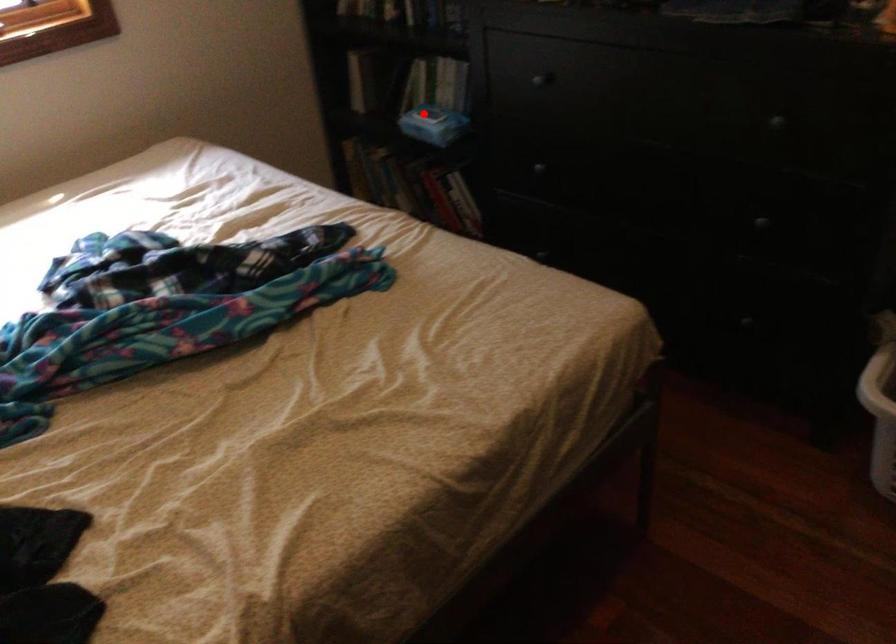
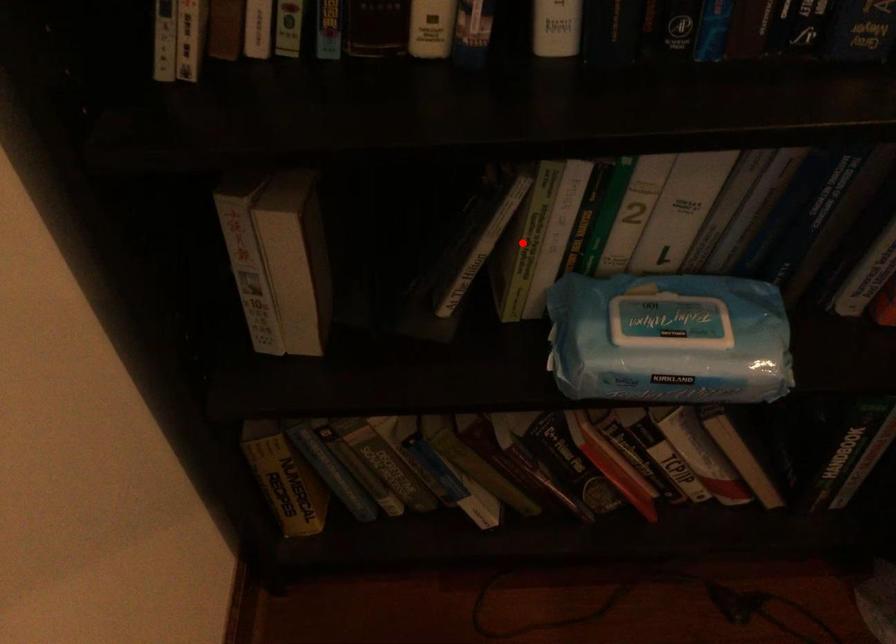
I am providing you with two images of the same scene from different viewpoints. A red point is marked on the first image and another point is marked on the second image. Are the points marked in image1 and image2 representing the same 3D position?

No